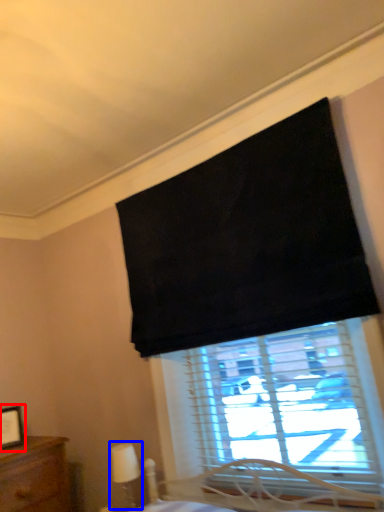
Question: Which of the following is the farthest to the observer, picture frame (highlighted by a red box) or table lamp (highlighted by a blue box)?

Choices:
 (A) picture frame
 (B) table lamp

Answer: (A)